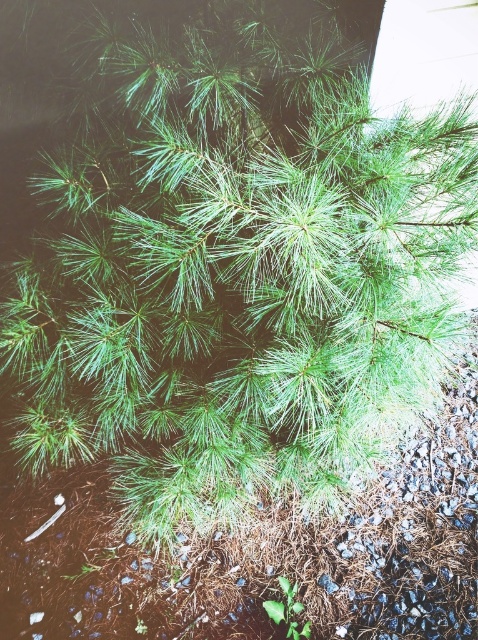
Question: Is brown mulch at center bigger than green leafy plant at bottom?

Choices:
 (A) no
 (B) yes

Answer: (B)

Question: Which point is farther to the camera?

Choices:
 (A) green leafy plant at bottom
 (B) brown mulch at center

Answer: (A)

Question: Is brown mulch at center in front of green leafy plant at bottom?

Choices:
 (A) yes
 (B) no

Answer: (A)

Question: Does brown mulch at center have a smaller size compared to green leafy plant at bottom?

Choices:
 (A) no
 (B) yes

Answer: (A)

Question: Among these points, which one is nearest to the camera?

Choices:
 (A) (278, 616)
 (B) (118, 614)

Answer: (A)